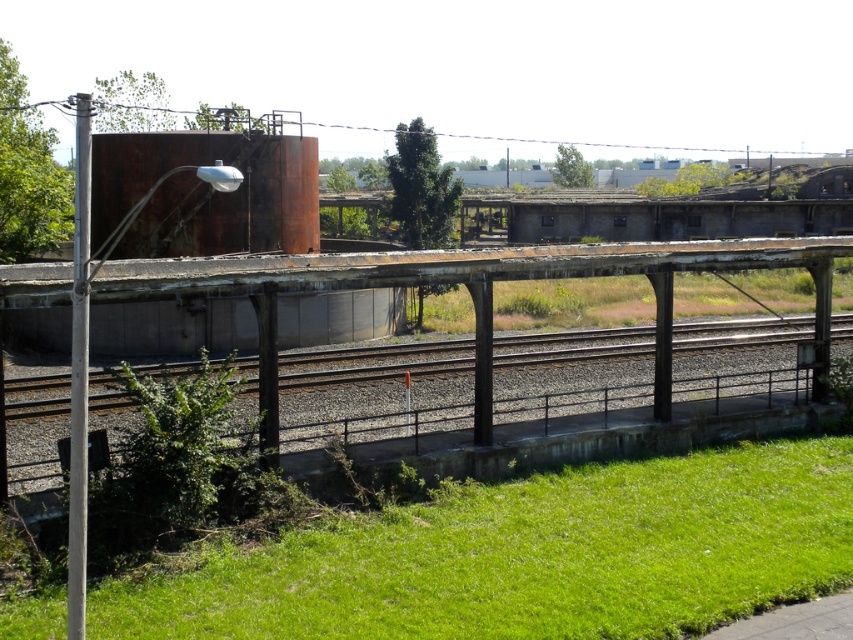
You are standing at the point marked as point (369, 285). What object are you standing on?

You are standing on the rusty metal platform at center located at point (369, 285).

You are a maintenance worker needing to reach the rusty metal platform at center from the green leafy plant at lower left. Can you walk directly to it without crossing any obstacles?

The rusty metal platform at center and green leafy plant at lower left are 8.83 meters apart. Since there are no mentioned obstacles between them in the scene description, you can walk directly to the platform.

You are a maintenance worker inspecting the area. You notice the green leafy plant at lower left and the rusty metal train track at center. Which object is closer to your current position?

The rusty metal train track at center is closer to your current position because the green leafy plant at lower left is behind it.